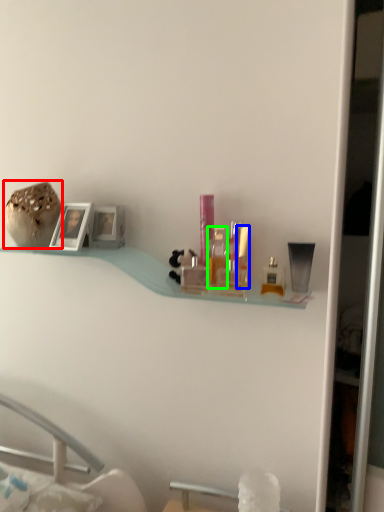
Question: Which object is positioned closest to product (highlighted by a red box)? Select from toiletry (highlighted by a blue box) and toiletry (highlighted by a green box).

Choices:
 (A) toiletry
 (B) toiletry

Answer: (B)